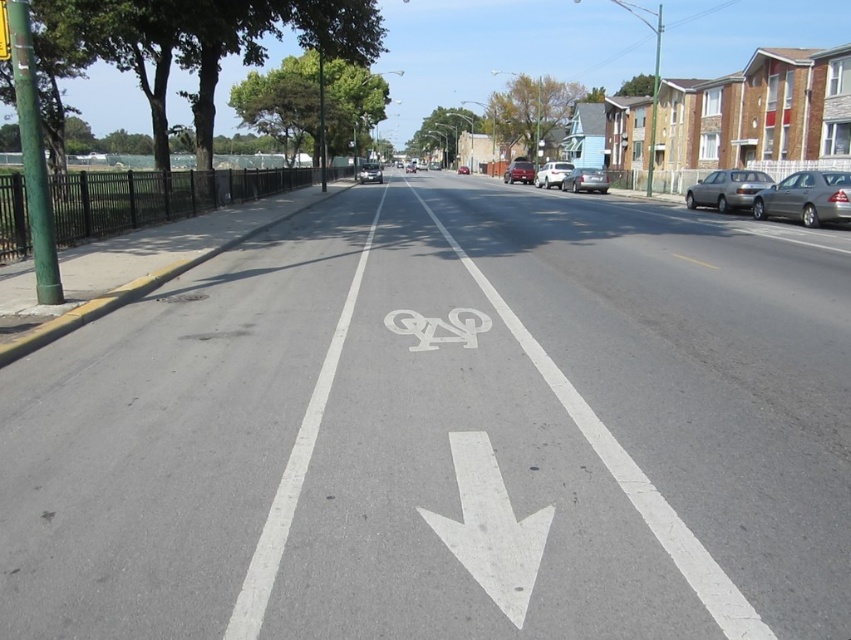
You are a cyclist planning to ride through the bicycle lane. You see a white painted arrow at center and a metallic red car at center. How far apart are these two objects from each other?

The white painted arrow at center and metallic red car at center are 58.71 meters apart from each other.

You are a pedestrian standing on the sidewalk and want to cross the road to reach the trees on the other side. There is a metallic gray sedan at right and a metallic red car at center in your path. Which car is closer to the sidewalk where you are standing?

The metallic red car at center is closer to the sidewalk where you are standing because the metallic gray sedan at right is positioned on the right side of it.